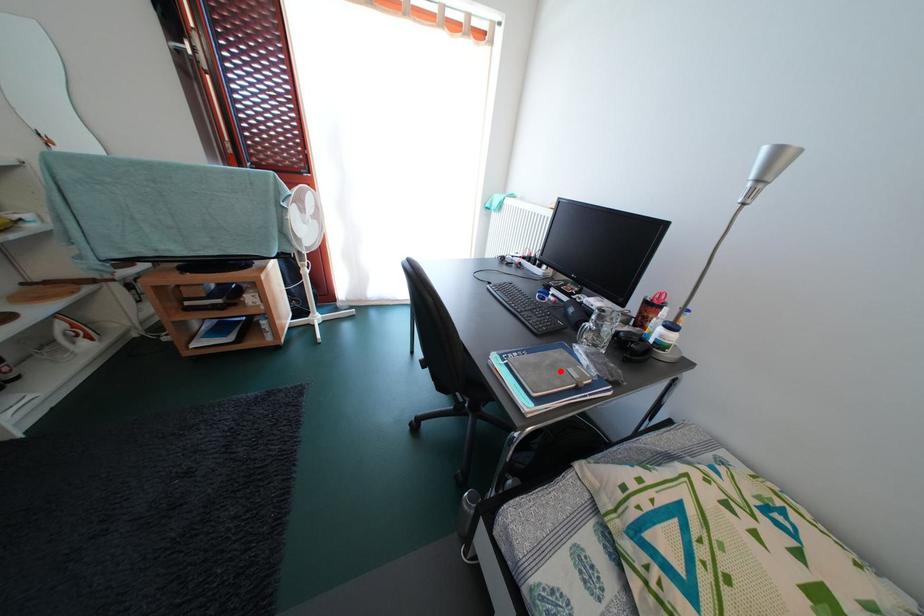
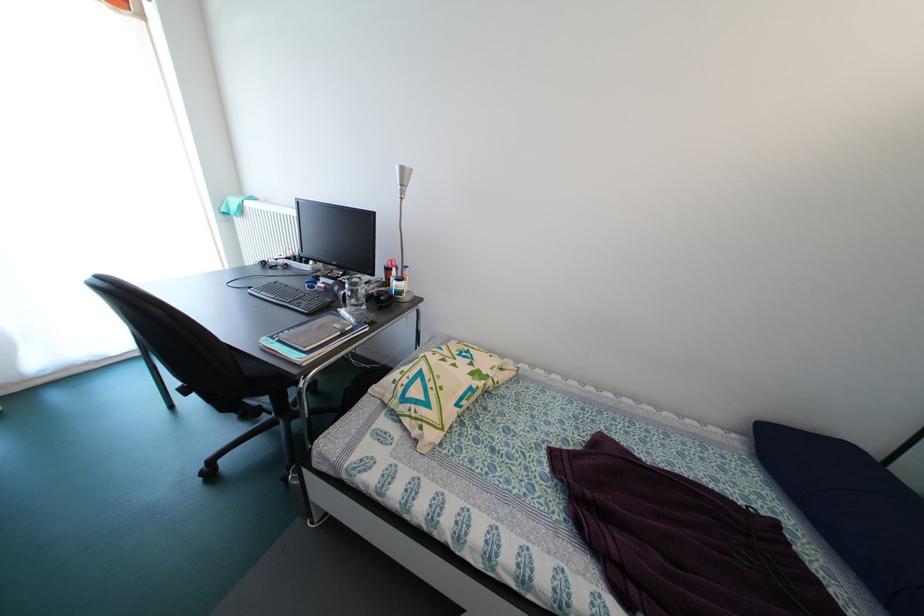
Locate, in the second image, the point that corresponds to the highlighted location in the first image.

(327, 331)